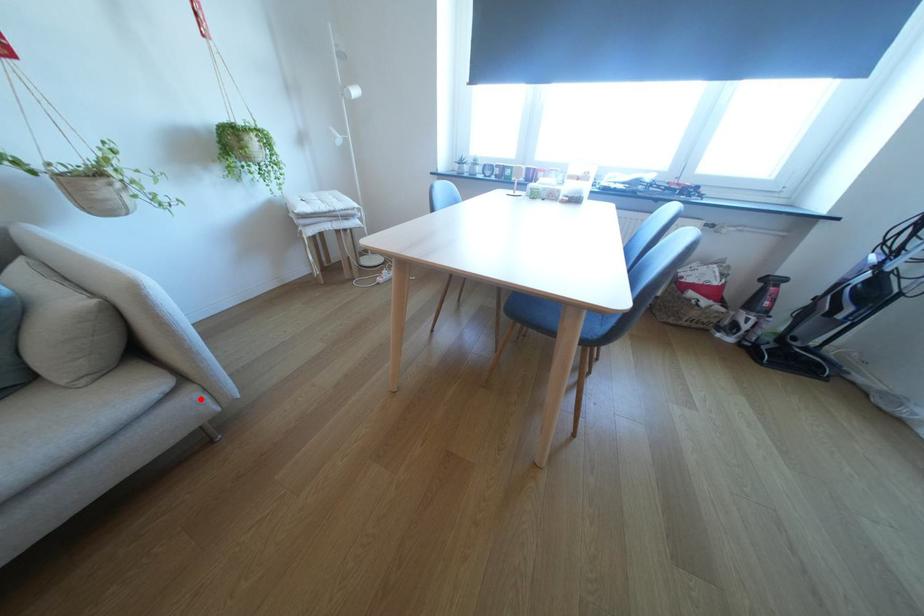
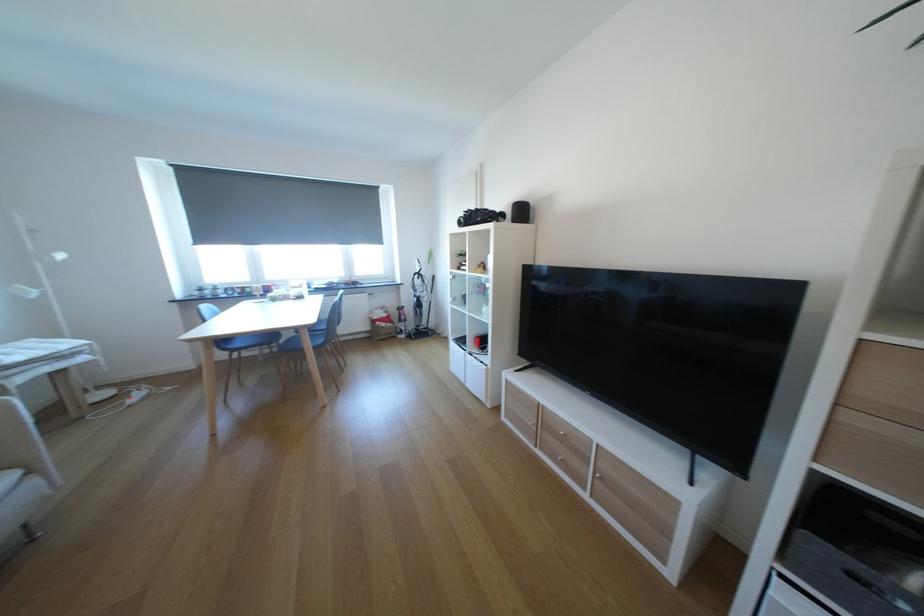
Where in the second image is the point corresponding to the highlighted location from the first image?

(45, 483)